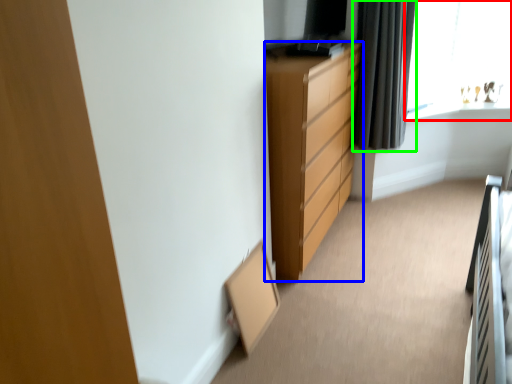
Question: Considering the real-world distances, which object is closest to window (highlighted by a red box)? chest of drawers (highlighted by a blue box) or curtain (highlighted by a green box).

Choices:
 (A) chest of drawers
 (B) curtain

Answer: (B)